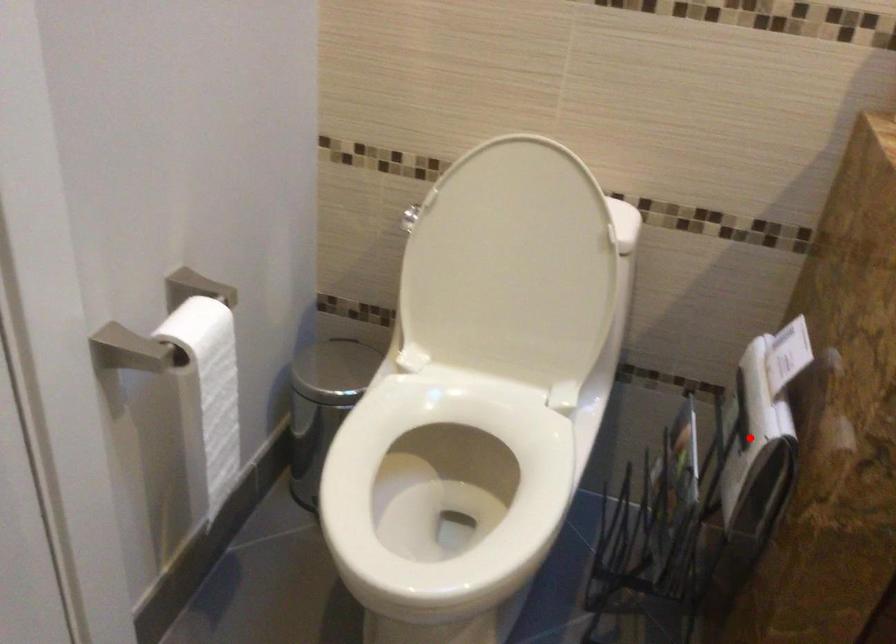
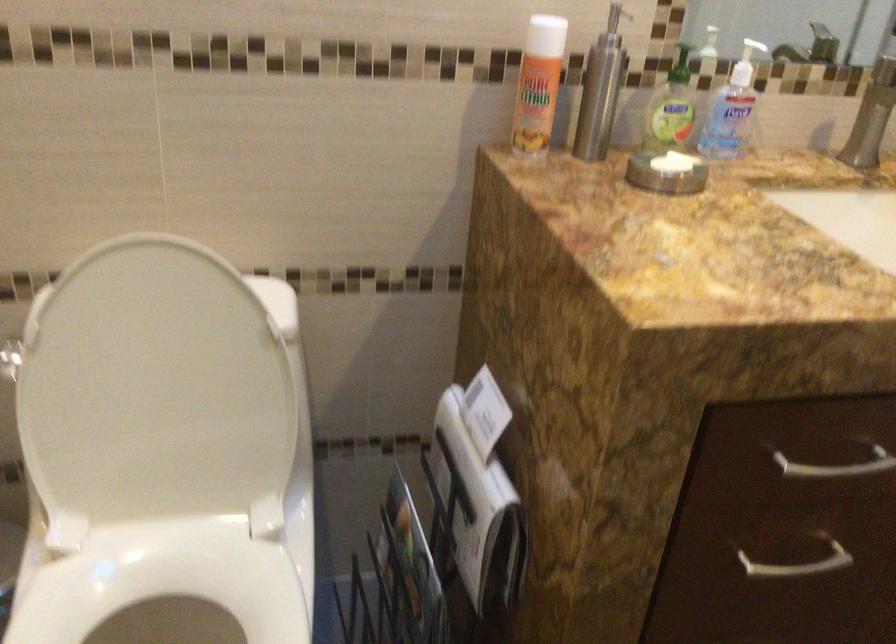
Locate, in the second image, the point that corresponds to the highlighted location in the first image.

(477, 512)